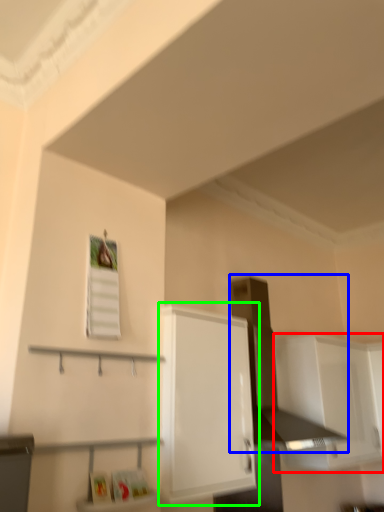
Question: Which is nearer to the cabinetry (highlighted by a red box)? vent (highlighted by a blue box) or cabinetry (highlighted by a green box).

Choices:
 (A) vent
 (B) cabinetry

Answer: (A)